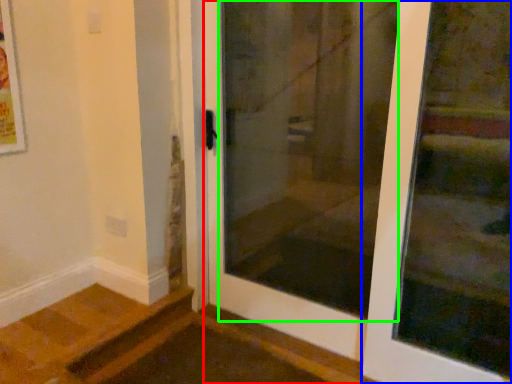
Question: Based on their relative distances, which object is nearer to door (highlighted by a red box)? Choose from door (highlighted by a blue box) and screen door (highlighted by a green box).

Choices:
 (A) door
 (B) screen door

Answer: (B)